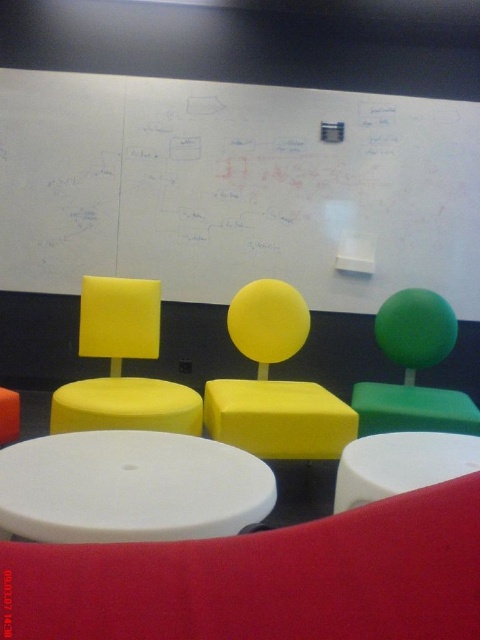
Between white glossy table at center and yellow matte stool at center, which one is positioned higher?

yellow matte stool at center

Measure the distance between white glossy table at center and yellow matte stool at center.

The distance of white glossy table at center from yellow matte stool at center is 37.46 inches.

Which is behind, point (455, 452) or point (143, 404)?

Positioned behind is point (143, 404).

The image size is (480, 640). Find the location of `white glossy table at center`. white glossy table at center is located at coordinates (400, 465).

Does yellow matte stool at center have a greater width compared to orange matte stool at lower left?

Yes.

Does yellow matte stool at center come in front of orange matte stool at lower left?

Yes, yellow matte stool at center is in front of orange matte stool at lower left.

Locate an element on the screen. The height and width of the screenshot is (640, 480). yellow matte stool at center is located at coordinates (126, 404).

Find the location of `yellow matte stool at center`. yellow matte stool at center is located at coordinates (126, 404).

How far apart are white matte round table at center and orange matte stool at lower left?

1.01 meters

Where is `white matte round table at center`? The width and height of the screenshot is (480, 640). white matte round table at center is located at coordinates pos(130,486).

Which is in front, point (33, 474) or point (2, 396)?

Point (33, 474) is in front.

Locate an element on the screen. Image resolution: width=480 pixels, height=640 pixels. white matte round table at center is located at coordinates (130, 486).